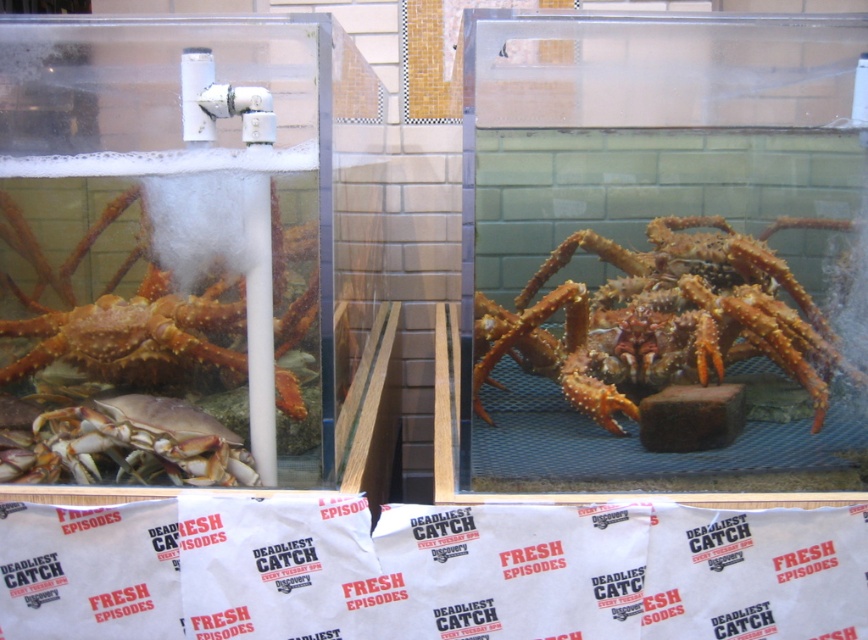
Question: Which object is farther from the camera taking this photo?

Choices:
 (A) smooth beige crab at left
 (B) shiny orange crab at left
 (C) spiny orange crab at center

Answer: (C)

Question: Can you confirm if spiny orange crab at center is wider than shiny orange crab at left?

Choices:
 (A) yes
 (B) no

Answer: (A)

Question: Can you confirm if spiny orange crab at center is positioned above smooth beige crab at left?

Choices:
 (A) no
 (B) yes

Answer: (B)

Question: Which point is closer to the camera?

Choices:
 (A) (858, 372)
 (B) (191, 432)

Answer: (B)

Question: Based on their relative distances, which object is nearer to the shiny orange crab at left?

Choices:
 (A) spiny orange crab at center
 (B) smooth beige crab at left

Answer: (B)

Question: Does shiny orange crab at left come in front of smooth beige crab at left?

Choices:
 (A) yes
 (B) no

Answer: (A)